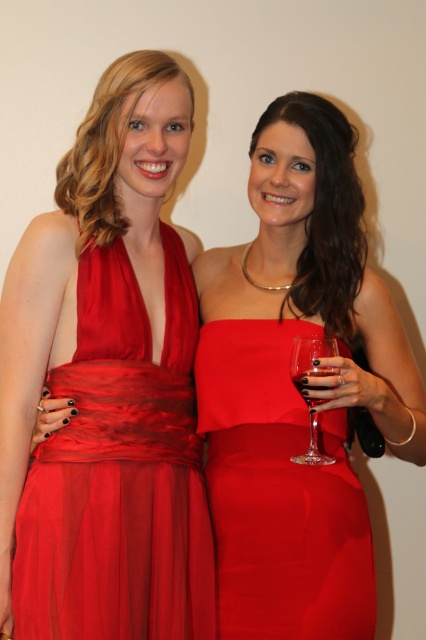
Consider the image. You are standing in front of a painting of two women in red dresses. There is a point marked at coordinates point (210,627). Can you tell me how far this point is from your current position?

The point (210,627) is 4.26 feet from the viewer.